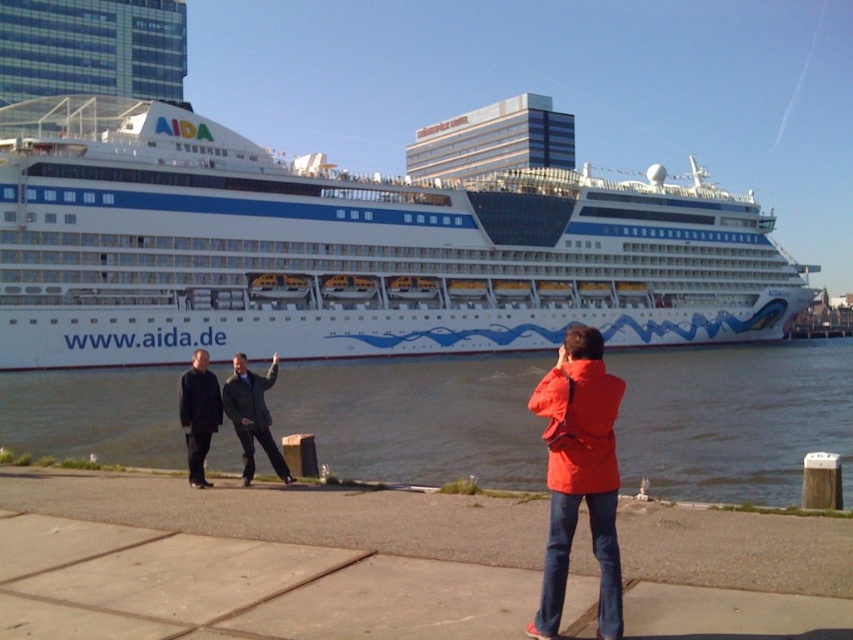
Question: Is white glossy cruise ship at center wider than dark gray wool coat at center?

Choices:
 (A) no
 (B) yes

Answer: (B)

Question: Where is white glossy cruise ship at center located in relation to dark gray suit at center in the image?

Choices:
 (A) below
 (B) above

Answer: (B)

Question: Which object appears closest to the camera in this image?

Choices:
 (A) matte red jacket at lower right
 (B) clear water at lower center

Answer: (A)

Question: Does clear water at lower center come behind matte red jacket at lower right?

Choices:
 (A) yes
 (B) no

Answer: (A)

Question: Which of the following is the farthest from the observer?

Choices:
 (A) white glossy cruise ship at center
 (B) dark gray wool coat at center

Answer: (A)

Question: Which object is farther from the camera taking this photo?

Choices:
 (A) dark gray wool coat at center
 (B) clear water at lower center
 (C) white glossy cruise ship at center

Answer: (C)